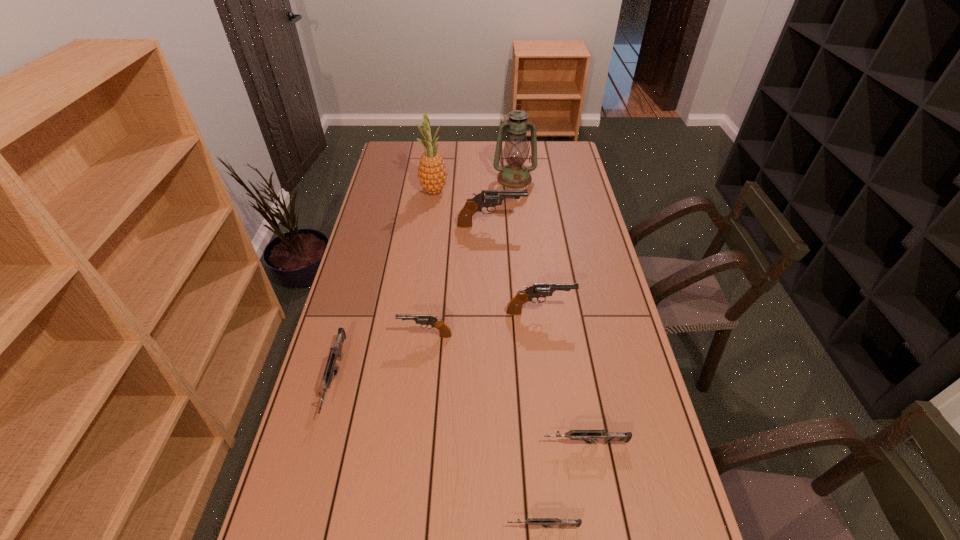
You are a GUI agent. You are given a task and a screenshot of the screen. Output one action in this format:
    pyautogui.click(x=<x>, y=<y>)
    Task: Click on the pineapple
    Image resolution: width=960 pixels, height=540 pixels.
    Given the screenshot: What is the action you would take?
    pyautogui.click(x=432, y=174)

Locate an element on the screen. The image size is (960, 540). oil lamp is located at coordinates (514, 174).

The height and width of the screenshot is (540, 960). In order to click on the farthest gun in this screenshot , I will do `click(491, 197)`.

The width and height of the screenshot is (960, 540). Identify the location of the biggest black gun. (491, 197).

The width and height of the screenshot is (960, 540). What are the coordinates of `the fifth nearest object` in the screenshot? It's located at (514, 307).

You are a GUI agent. You are given a task and a screenshot of the screen. Output one action in this format:
    pyautogui.click(x=<x>, y=<y>)
    Task: Click on the fifth shortest object
    
    Given the screenshot: What is the action you would take?
    pyautogui.click(x=514, y=307)

Find the location of a particular element. The height and width of the screenshot is (540, 960). the third farthest gun is located at coordinates (445, 332).

Locate an element on the screen. The width and height of the screenshot is (960, 540). the fourth nearest object is located at coordinates (445, 332).

Identify the location of the third nearest object. The height and width of the screenshot is (540, 960). (335, 353).

Identify the location of the leftmost gun. (335, 353).